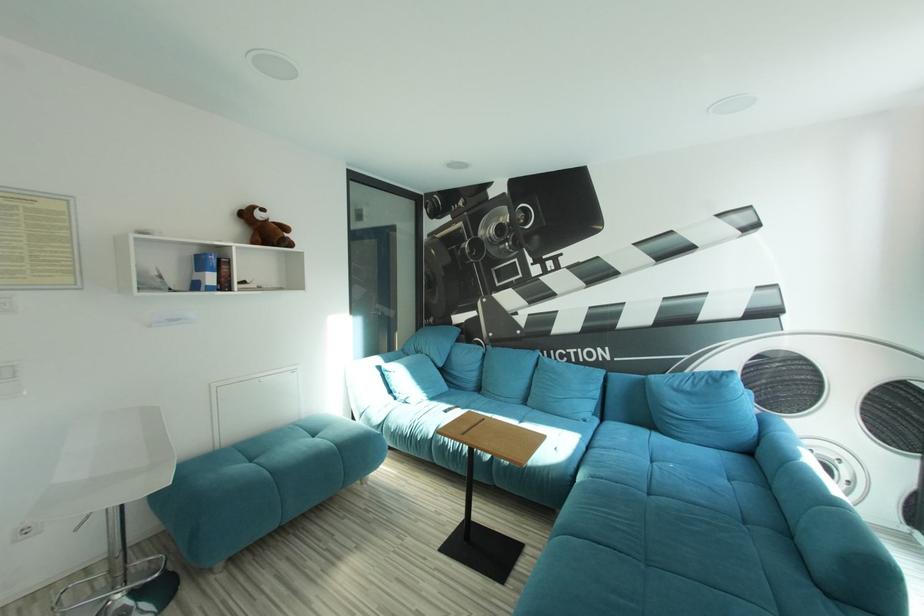
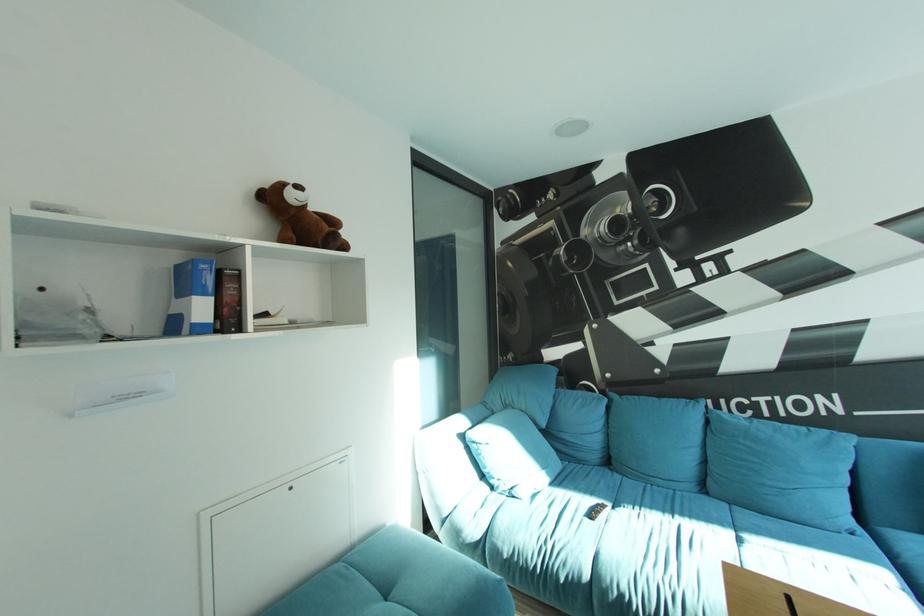
In a continuous first-person perspective shot, in which direction is the camera moving?

The cameraman moved toward left, forward.